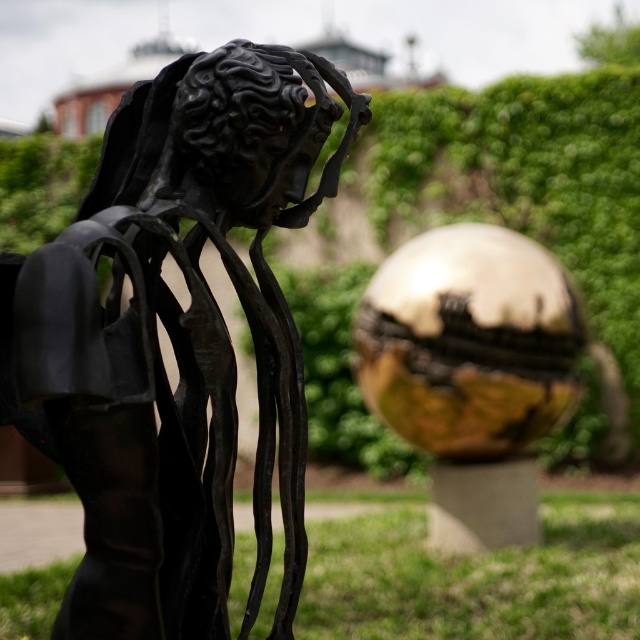
Can you confirm if black matte sculpture at left is smaller than green leafy hedge at upper center?

Correct, black matte sculpture at left occupies less space than green leafy hedge at upper center.

Does black matte sculpture at left appear under green leafy hedge at upper center?

Yes, black matte sculpture at left is below green leafy hedge at upper center.

The image size is (640, 640). In order to click on black matte sculpture at left in this screenshot , I will do `click(173, 340)`.

I want to click on black matte sculpture at left, so click(173, 340).

Is point (604, 321) positioned in front of point (596, 579)?

No, (604, 321) is behind (596, 579).

Where is `green leafy hedge at upper center`? Image resolution: width=640 pixels, height=640 pixels. green leafy hedge at upper center is located at coordinates (522, 180).

Is black matte sculpture at left further to the viewer compared to green grass at lower right?

No, it is in front of green grass at lower right.

This screenshot has width=640, height=640. What do you see at coordinates (173, 340) in the screenshot?
I see `black matte sculpture at left` at bounding box center [173, 340].

You are a GUI agent. You are given a task and a screenshot of the screen. Output one action in this format:
    pyautogui.click(x=<x>, y=<y>)
    Task: Click on the black matte sculpture at left
    This screenshot has width=640, height=640.
    Given the screenshot: What is the action you would take?
    [x=173, y=340]